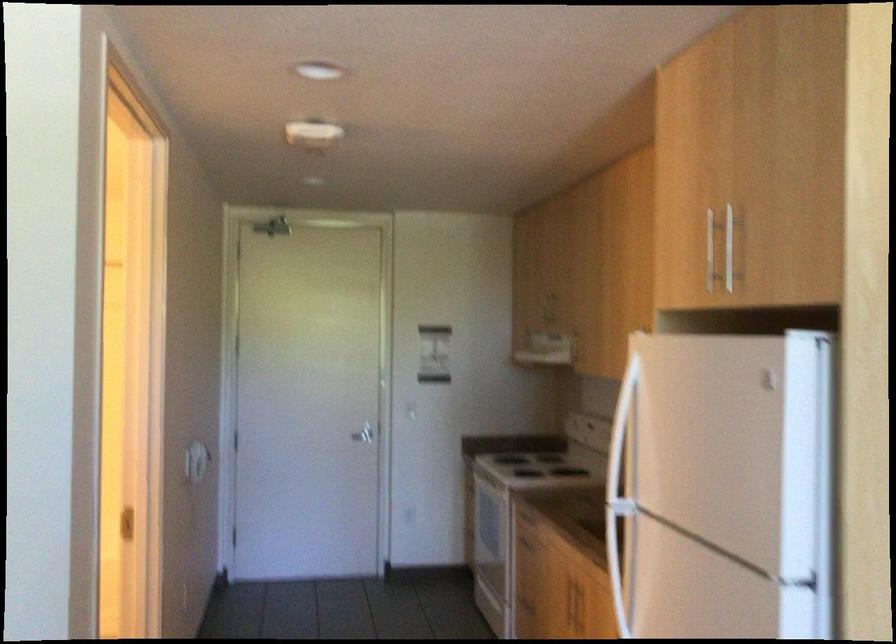
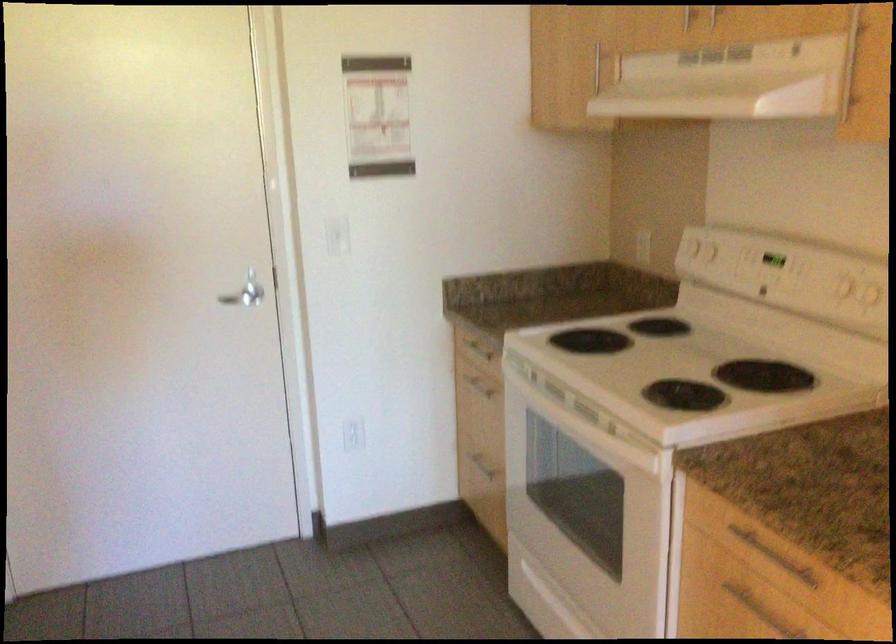
Question: Which direction would the cameraman need to move to produce the second image? Reply with the corresponding letter.

Choices:
 (A) Left
 (B) Right
 (C) Forward
 (D) Backward

Answer: (C)